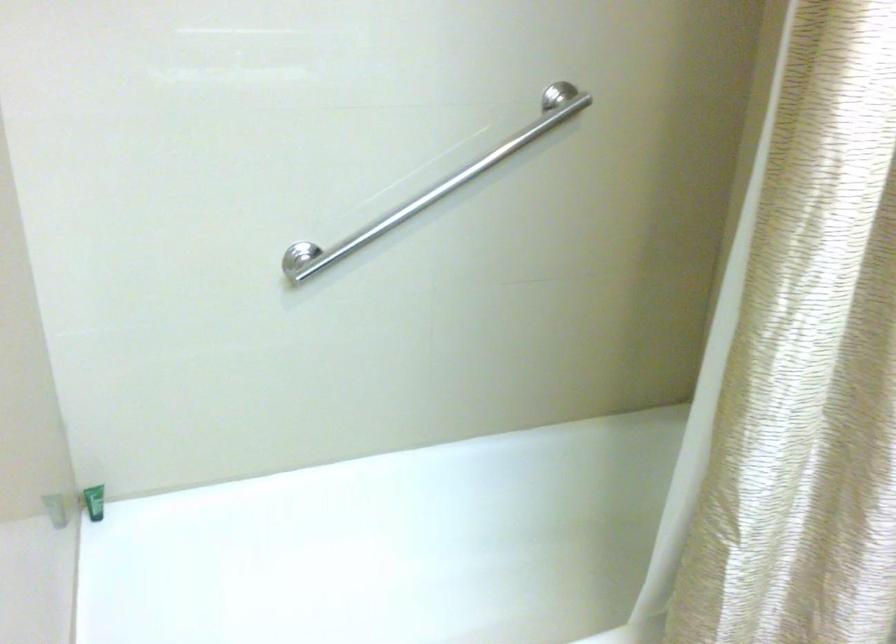
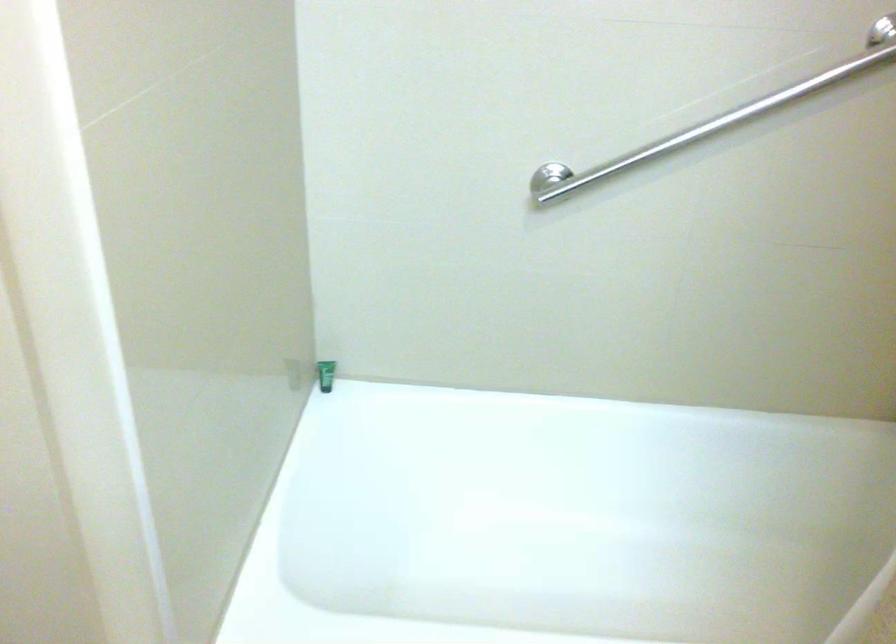
Find the pixel in the second image that matches (x=95, y=500) in the first image.

(325, 375)